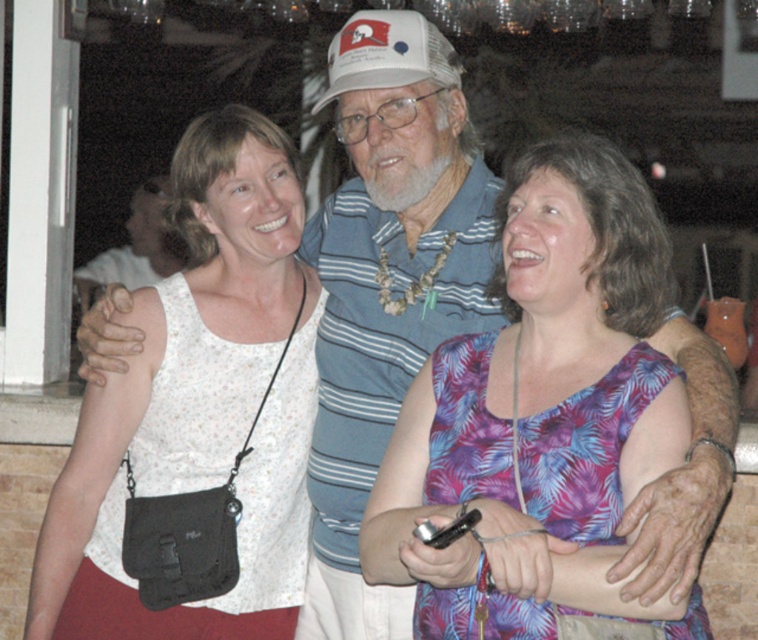
Question: Among these objects, which one is farthest from the camera?

Choices:
 (A) purple floral dress at center
 (B) white fabric tank top at center

Answer: (B)

Question: Which object is the closest to the purple floral dress at center?

Choices:
 (A) white fabric tank top at center
 (B) white mesh baseball cap at center

Answer: (A)

Question: Estimate the real-world distances between objects in this image. Which object is closer to the purple floral dress at center?

Choices:
 (A) white fabric tank top at center
 (B) white mesh baseball cap at center

Answer: (A)

Question: Does white fabric tank top at center appear on the right side of white mesh baseball cap at center?

Choices:
 (A) yes
 (B) no

Answer: (B)

Question: Considering the relative positions of purple floral dress at center and white fabric tank top at center in the image provided, where is purple floral dress at center located with respect to white fabric tank top at center?

Choices:
 (A) left
 (B) right

Answer: (B)

Question: Is purple floral dress at center wider than white fabric tank top at center?

Choices:
 (A) no
 (B) yes

Answer: (A)